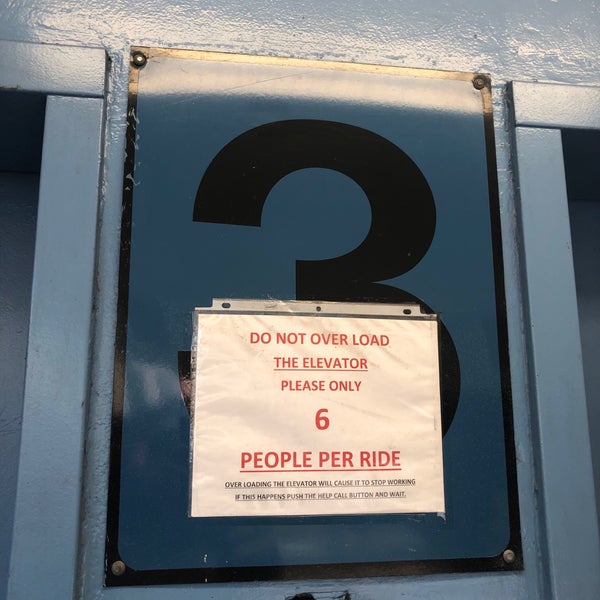
At what (x,y) coordinates should I click in order to perform the action: click on blue wall. Please return your answer as a coordinate pair (x, y). Image resolution: width=600 pixels, height=600 pixels. Looking at the image, I should click on (545, 279).